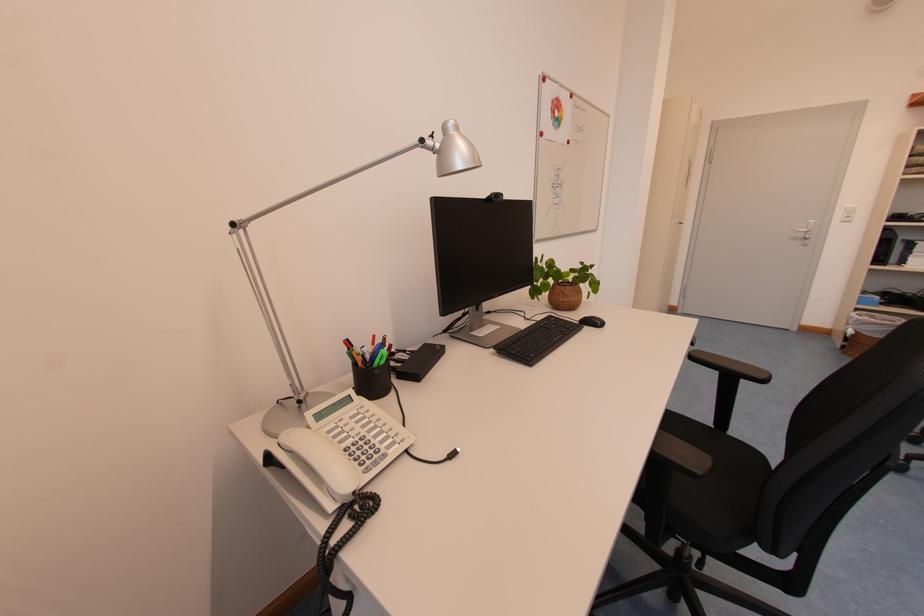
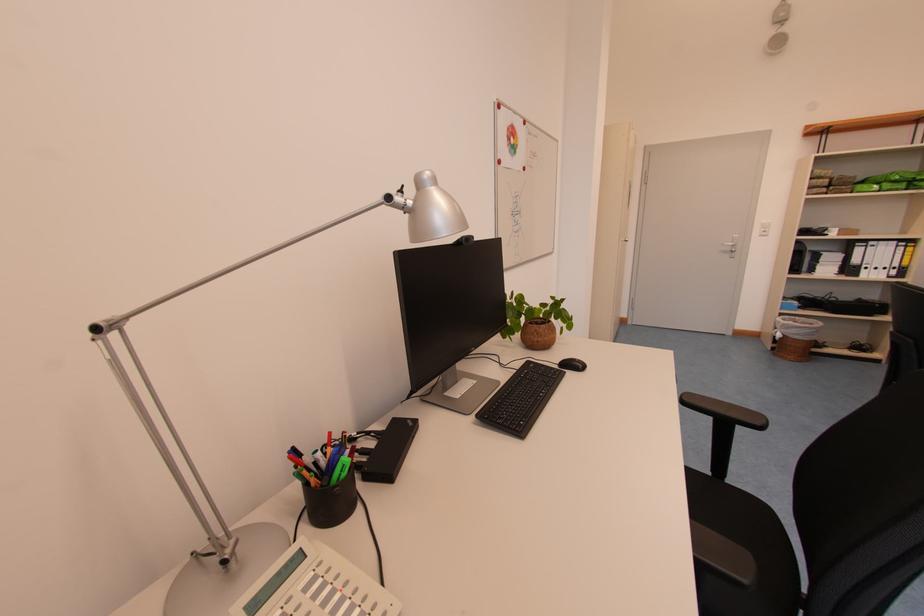
Where in the second image is the point corresponding to point 584,325 from the first image?

(564, 369)